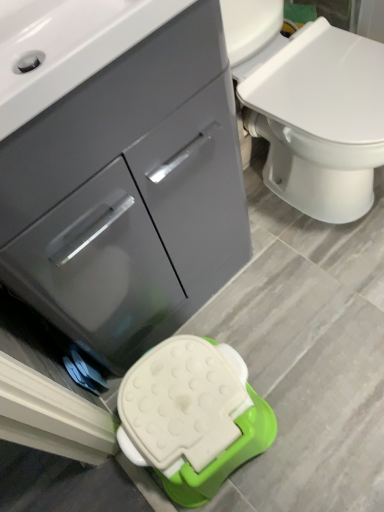
The width and height of the screenshot is (384, 512). I want to click on free space to the right of white plastic stool at lower center, so click(x=290, y=402).